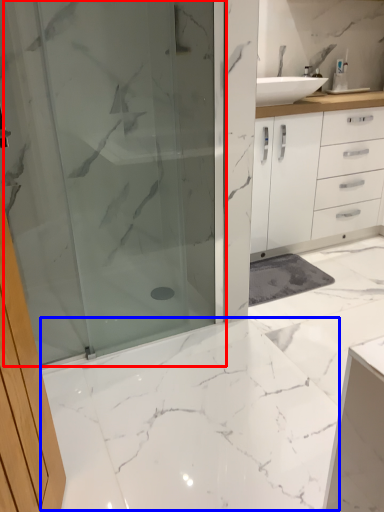
Question: Which object appears farthest to the camera in this image, shower door (highlighted by a red box) or marble (highlighted by a blue box)?

Choices:
 (A) shower door
 (B) marble

Answer: (A)